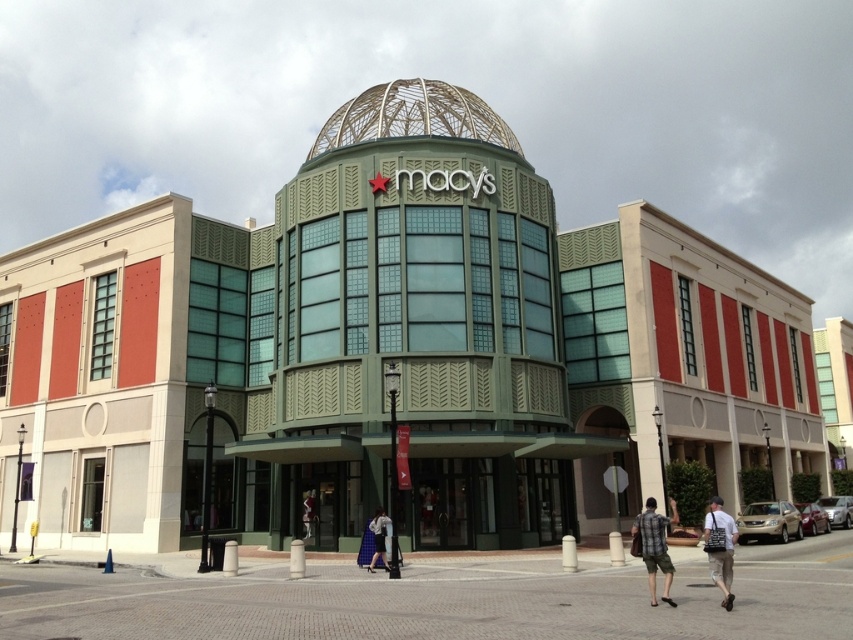
You are a delivery person trying to enter the Macy store. You have a large box that is 2 meters wide. The entrance has a covered walkway supported by columns. You need to know if the metallic wireframe dome at center and the denim pants at lower center will block your path. Can you determine if the path between them is wide enough for your box?

The metallic wireframe dome at center might be wider than denim pants at lower center, so the path between them may be wide enough for your 2 meter wide box. However, since the exact width is uncertain, you should check the actual space before proceeding.